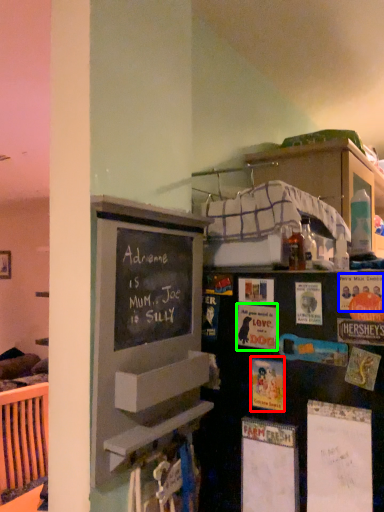
Question: Which object is positioned closest to postcard (highlighted by a red box)? Select from postcard (highlighted by a blue box) and postcard (highlighted by a green box).

Choices:
 (A) postcard
 (B) postcard

Answer: (B)